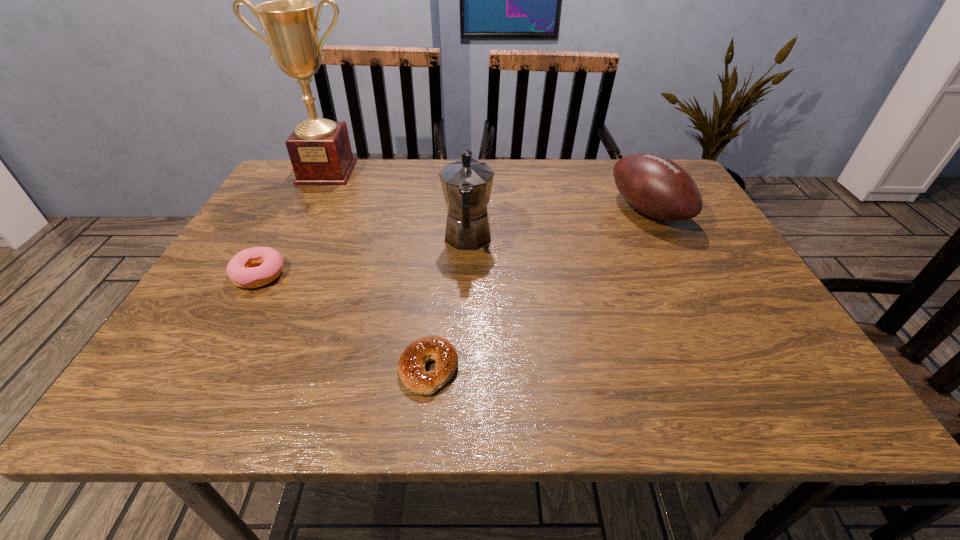
You are a GUI agent. You are given a task and a screenshot of the screen. Output one action in this format:
    pyautogui.click(x=<x>, y=<y>)
    Task: Click on the vacant space that's between the fourth shortest object and the fourth tallest object
    The image size is (960, 540).
    Given the screenshot: What is the action you would take?
    pyautogui.click(x=363, y=257)

Locate an element on the screen. The image size is (960, 540). free space between the second shortest object and the coffeepot is located at coordinates tap(363, 257).

The image size is (960, 540). I want to click on unoccupied area between the bagel and the trophy cup, so click(378, 271).

Locate an element on the screen. Image resolution: width=960 pixels, height=540 pixels. empty space that is in between the bagel and the fourth shortest object is located at coordinates (448, 304).

What are the coordinates of `free spot between the fourth tallest object and the nearest object` in the screenshot? It's located at (344, 322).

Locate an element on the screen. free area in between the coffeepot and the farthest object is located at coordinates (397, 206).

The height and width of the screenshot is (540, 960). In order to click on free space between the second tallest object and the trophy cup in this screenshot , I will do `click(397, 206)`.

Where is `empty location between the second tallest object and the bagel`? empty location between the second tallest object and the bagel is located at coordinates (448, 304).

Locate an element on the screen. The width and height of the screenshot is (960, 540). object identified as the second closest to the football (American) is located at coordinates (411, 366).

This screenshot has width=960, height=540. I want to click on object that stands as the closest to the tallest object, so click(x=467, y=183).